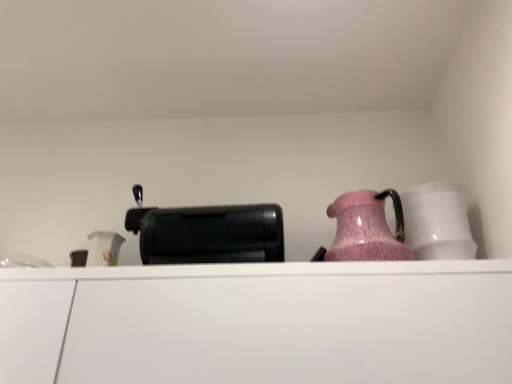
Question: Is white glossy mug at right positioned in front of white matte cabinet at center?

Choices:
 (A) no
 (B) yes

Answer: (A)

Question: Is white glossy mug at right outside of white matte cabinet at center?

Choices:
 (A) yes
 (B) no

Answer: (A)

Question: Is white glossy mug at right not close to white matte cabinet at center?

Choices:
 (A) yes
 (B) no

Answer: (B)

Question: Is white glossy mug at right taller than white matte cabinet at center?

Choices:
 (A) no
 (B) yes

Answer: (A)

Question: Can you confirm if white glossy mug at right is positioned to the left of white matte cabinet at center?

Choices:
 (A) yes
 (B) no

Answer: (B)

Question: Is white glossy mug at right turned away from white matte cabinet at center?

Choices:
 (A) no
 (B) yes

Answer: (A)

Question: From the image's perspective, does black plastic toaster at center appear lower than pink glossy jug at upper right?

Choices:
 (A) no
 (B) yes

Answer: (B)

Question: Is black plastic toaster at center positioned in front of pink glossy jug at upper right?

Choices:
 (A) no
 (B) yes

Answer: (A)

Question: From a real-world perspective, is black plastic toaster at center over pink glossy jug at upper right?

Choices:
 (A) yes
 (B) no

Answer: (A)

Question: Is black plastic toaster at center with pink glossy jug at upper right?

Choices:
 (A) no
 (B) yes

Answer: (A)

Question: Does black plastic toaster at center have a larger size compared to pink glossy jug at upper right?

Choices:
 (A) no
 (B) yes

Answer: (B)

Question: Is black plastic toaster at center shorter than pink glossy jug at upper right?

Choices:
 (A) no
 (B) yes

Answer: (B)

Question: Is white matte cabinet at center at the back of black plastic toaster at center?

Choices:
 (A) no
 (B) yes

Answer: (A)